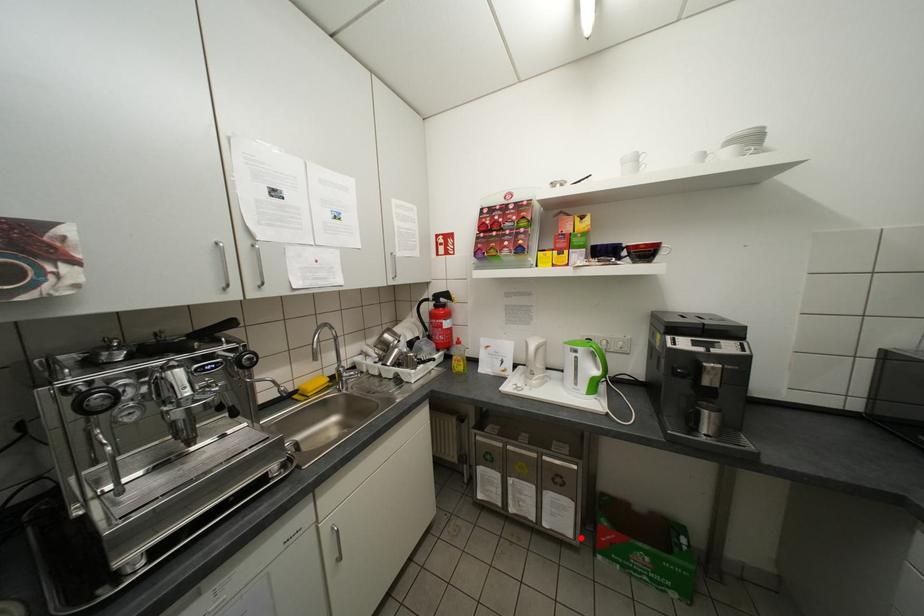
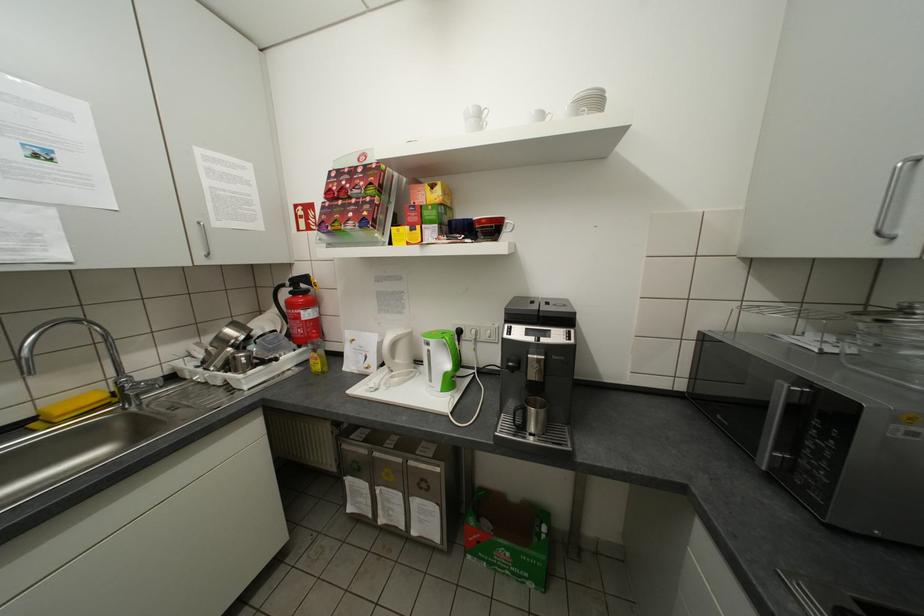
In the second image, find the point that corresponds to the highlighted location in the first image.

(448, 543)